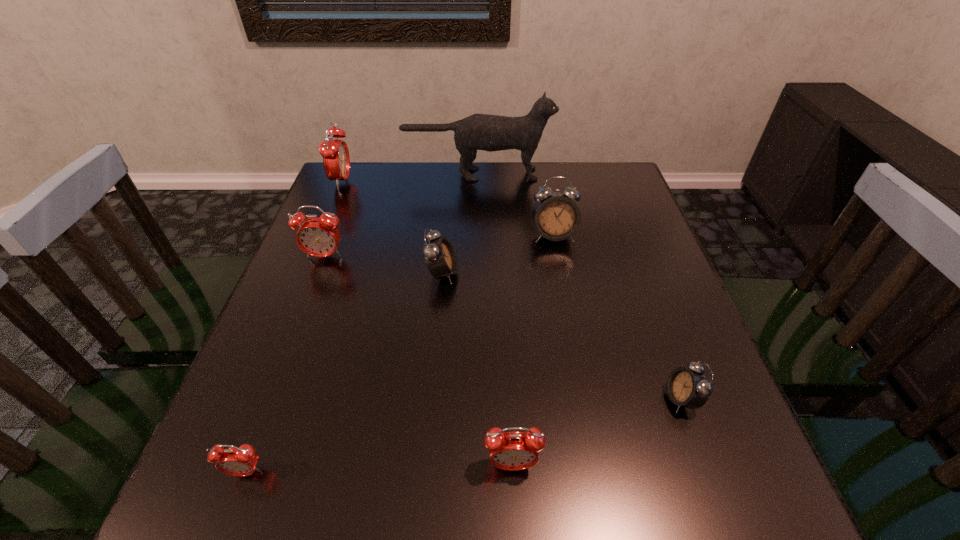
This screenshot has height=540, width=960. I want to click on vacant space in between the second farthest red alarm clock and the smallest red alarm clock, so click(x=285, y=364).

The width and height of the screenshot is (960, 540). Identify the location of free space between the farthest alarm clock and the cat. click(410, 178).

Locate which object is the second closest to the fourth alarm clock from left to right. Please provide its 2D coordinates. Your answer should be formatted as a tuple, i.e. [(x, y)], where the tuple contains the x and y coordinates of a point satisfying the conditions above.

[(317, 236)]

Image resolution: width=960 pixels, height=540 pixels. I want to click on object that stands as the sixth closest to the leftmost white alarm clock, so click(x=241, y=461).

Identify which alarm clock is located as the fourth nearest to the leftmost white alarm clock. Please provide its 2D coordinates. Your answer should be formatted as a tuple, i.e. [(x, y)], where the tuple contains the x and y coordinates of a point satisfying the conditions above.

[(513, 450)]

What are the coordinates of `alarm clock that is the fifth closest one to the smallest red alarm clock` in the screenshot? It's located at (556, 216).

You are a GUI agent. You are given a task and a screenshot of the screen. Output one action in this format:
    pyautogui.click(x=<x>, y=<y>)
    Task: Click on the red alarm clock that is the fourth closest to the third nearest alarm clock
    
    Given the screenshot: What is the action you would take?
    pyautogui.click(x=335, y=153)

This screenshot has width=960, height=540. What are the coordinates of `red alarm clock that is the fourth closest to the smallest white alarm clock` in the screenshot? It's located at (335, 153).

Identify the location of the closest white alarm clock to the tallest object. (556, 216).

Select which white alarm clock is the second closest to the second biggest white alarm clock. Please provide its 2D coordinates. Your answer should be formatted as a tuple, i.e. [(x, y)], where the tuple contains the x and y coordinates of a point satisfying the conditions above.

[(689, 387)]